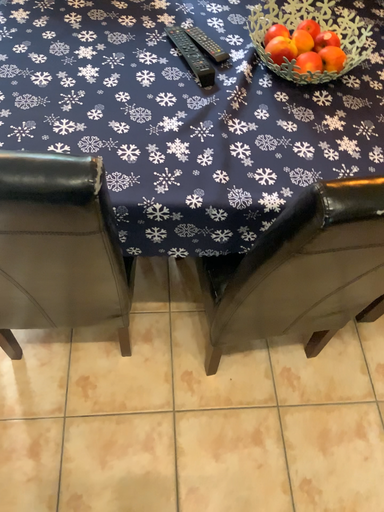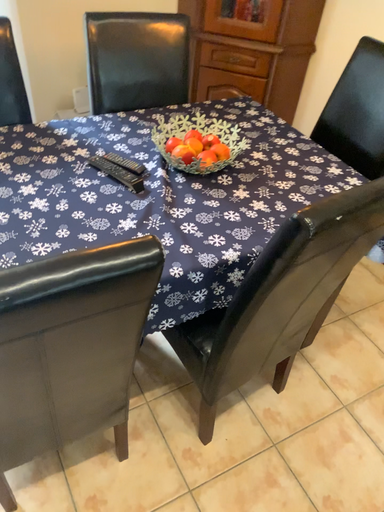
Question: How did the camera likely rotate when shooting the video?

Choices:
 (A) rotated downward
 (B) rotated upward

Answer: (B)